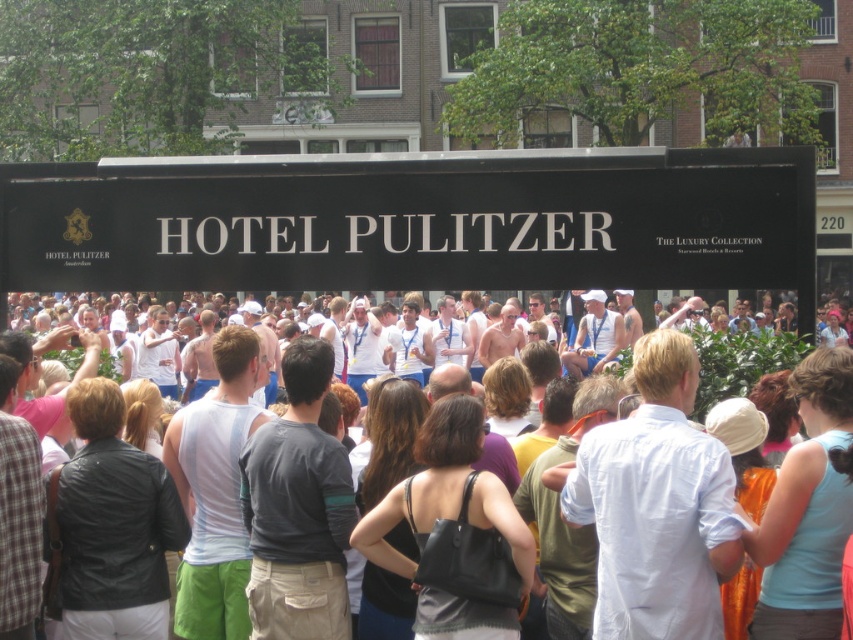
You are a photographer positioned to the left of the black matte sign at upper center and white cotton tank tops at center. You want to capture a photo that includes both objects in the frame. Which direction should you move to ensure both objects are visible?

Since the black matte sign at upper center is to the left of white cotton tank tops at center, you should move to the right to ensure both objects are visible in the frame.

You are a photographer standing in front of the black matte sign at upper center and the white cotton tank tops at center. You want to take a photo that includes both objects in the frame. Which object should you focus on first to ensure both are in focus?

The black matte sign at upper center is above the white cotton tank tops at center, so you should focus on the black matte sign at upper center first to ensure both are in focus.

You are standing in front of the black matte sign at upper center and want to see the white cotton tank tops at center. Which direction should you move to get a better view?

→ You should move backward because the black matte sign at upper center is closer to you than the white cotton tank tops at center, so moving back will allow you to see both objects in the scene better.